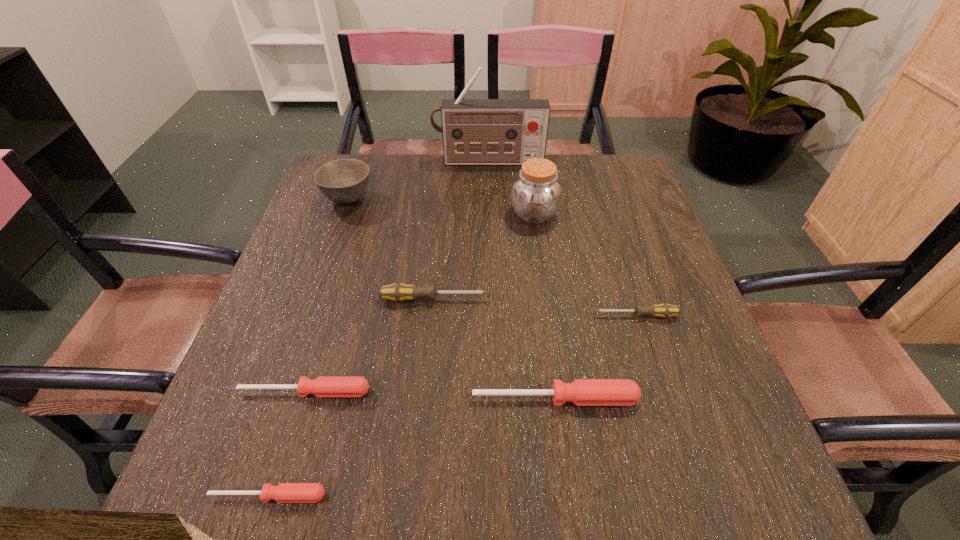
Find the location of a particular element. This screenshot has width=960, height=540. blank space located at the tip of the fourth nearest object is located at coordinates (433, 315).

At what (x,y) coordinates should I click in order to perform the action: click on vacant region located 0.170m at the tip of the fourth nearest object. Please return your answer as a coordinate pair (x, y). The image size is (960, 540). Looking at the image, I should click on (514, 315).

Find the location of a particular element. The width and height of the screenshot is (960, 540). vacant space located on the right of the nearest object is located at coordinates (487, 496).

Identify the location of radio receiver that is at the far edge. (475, 131).

Image resolution: width=960 pixels, height=540 pixels. I want to click on jar that is at the far edge, so click(536, 194).

The height and width of the screenshot is (540, 960). Identify the location of bowl that is at the far edge. (344, 181).

Locate an element on the screen. object at the near edge is located at coordinates (284, 492).

At what (x,y) coordinates should I click in order to perform the action: click on bowl located in the left edge section of the desktop. Please return your answer as a coordinate pair (x, y). The height and width of the screenshot is (540, 960). Looking at the image, I should click on (344, 181).

This screenshot has width=960, height=540. What are the coordinates of `object at the right edge` in the screenshot? It's located at (663, 310).

Identify the location of object at the far left corner. This screenshot has height=540, width=960. (344, 181).